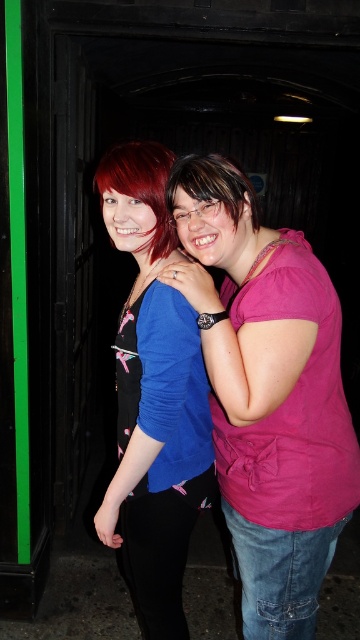
You are a photographer trying to capture a clear photo of both the pink matte shirt at center and the blue fabric shirt at center. Since you want both shirts to be in focus, which one should you focus on first to ensure the other is also sharp?

You should focus on the pink matte shirt at center first because it is closer to the viewer. By focusing on the closer object, the depth of field may extend to include the blue fabric shirt at center in the background, ensuring both are sharp.

You are a photographer trying to capture a clear photo of both the shiny red hair at center and the matte pink shirt at center. Since you can only focus on one object at a time, which one should you focus on to ensure the other is also in focus?

You should focus on the shiny red hair at center because it is closer to you than the matte pink shirt at center, so focusing on the closer object will keep both in focus.

You are holding a camera and want to take a photo of the shiny red hair at center. The camera requires a minimum distance of 1.2 meters to focus properly. Can you take a clear photo from your current position?

The shiny red hair at center and camera are 1.19 meters apart. Since the required minimum distance is 1.2 meters, the camera is too close to focus properly. Move back slightly to ensure clear focus.